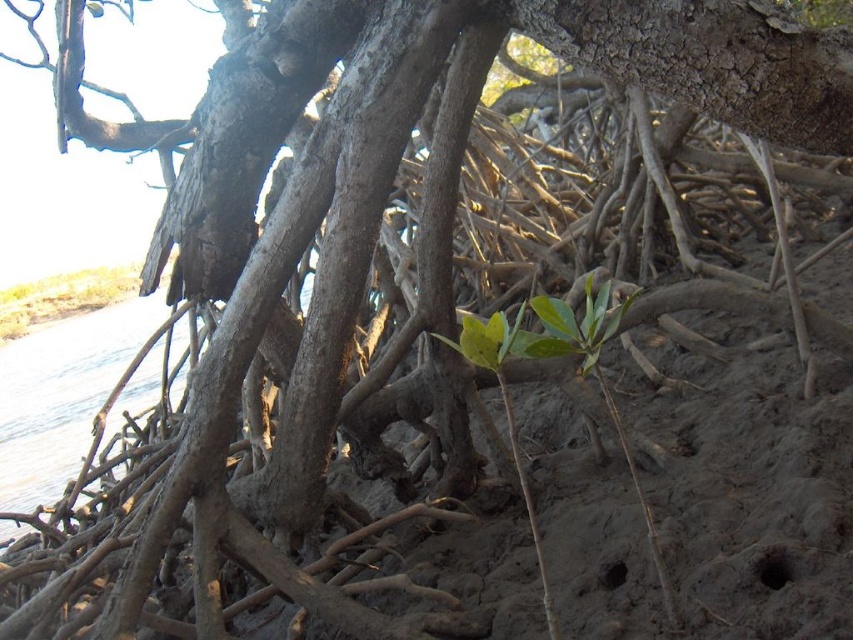
Does clear water at lower left appear over green leafy plant at upper left?

No, clear water at lower left is not above green leafy plant at upper left.

Can you confirm if clear water at lower left is smaller than green leafy plant at upper left?

No, clear water at lower left is not smaller than green leafy plant at upper left.

Is point (91, 388) farther from viewer compared to point (22, 314)?

No, it is not.

You are a GUI agent. You are given a task and a screenshot of the screen. Output one action in this format:
    pyautogui.click(x=<x>, y=<y>)
    Task: Click on the clear water at lower left
    This screenshot has height=640, width=853.
    Given the screenshot: What is the action you would take?
    pyautogui.click(x=62, y=394)